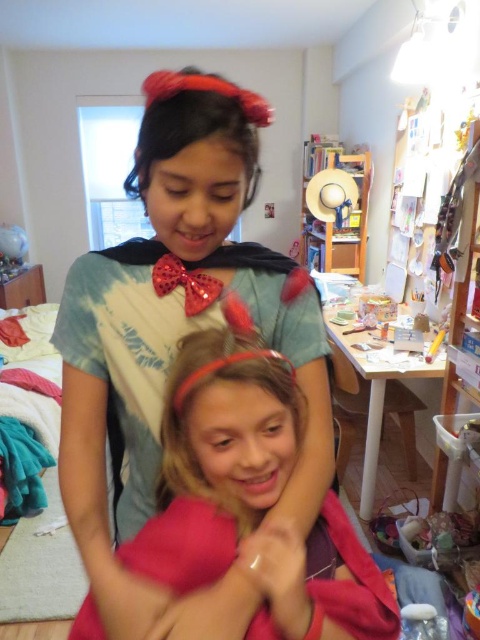
Can you confirm if matte black cape at upper center is smaller than blonde hair at center?

No.

Is point (81, 419) less distant than point (228, 413)?

That is False.

What are the coordinates of `matte black cape at upper center` in the screenshot? It's located at (176, 344).

Between matte red headband at upper center and shiny sequined bow tie at center, which one appears on the left side from the viewer's perspective?

Positioned to the left is shiny sequined bow tie at center.

Measure the distance between point (170,132) and camera.

A distance of 25.70 inches exists between point (170,132) and camera.

The height and width of the screenshot is (640, 480). What are the coordinates of `matte red headband at upper center` in the screenshot? It's located at (195, 122).

Is pink fabric at center bigger than matte red headband at upper center?

Indeed, pink fabric at center has a larger size compared to matte red headband at upper center.

Who is more forward, [239,362] or [144,140]?

Point [239,362] is in front.

Which is behind, point (188, 413) or point (201, 88)?

Positioned behind is point (201, 88).

The image size is (480, 640). I want to click on pink fabric at center, so click(250, 499).